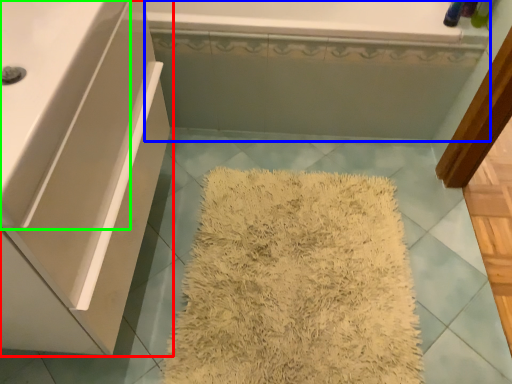
Question: Which object is positioned farthest from bathroom cabinet (highlighted by a red box)? Select from bath (highlighted by a blue box) and counter top (highlighted by a green box).

Choices:
 (A) bath
 (B) counter top

Answer: (A)